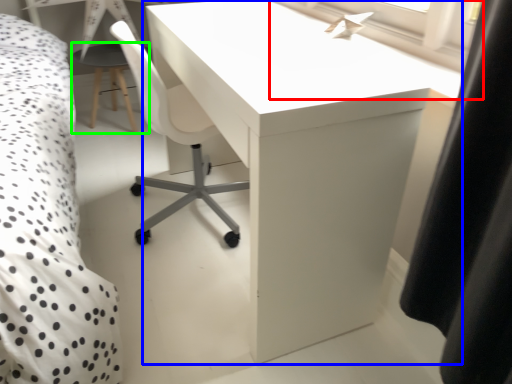
Question: Which object is the closest to the window screen (highlighted by a red box)? Choose among these: table (highlighted by a blue box) or side table (highlighted by a green box).

Choices:
 (A) table
 (B) side table

Answer: (A)